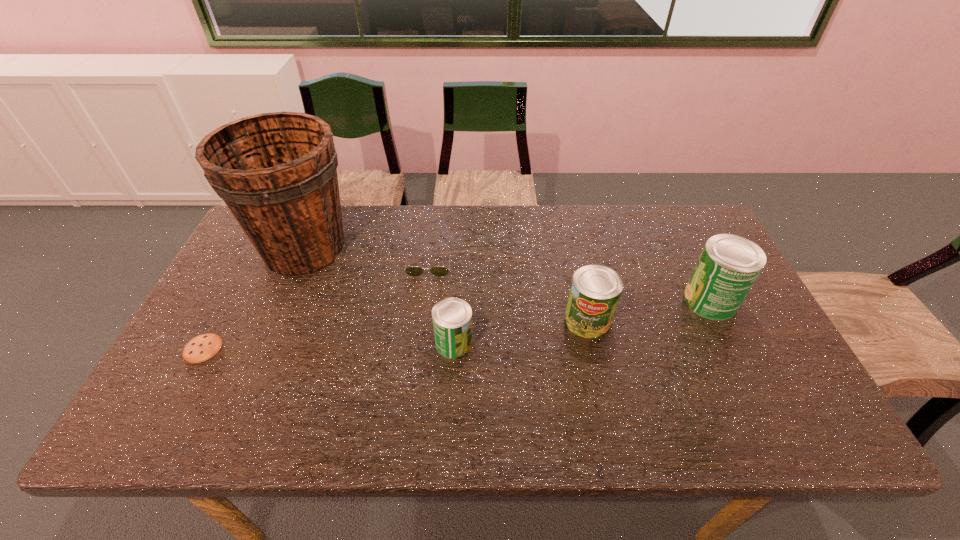
Where is `vacant space that satisfies the following two spatial constraints: 1. on the back side of the rightmost object; 2. on the left side of the third shortest object`? The image size is (960, 540). vacant space that satisfies the following two spatial constraints: 1. on the back side of the rightmost object; 2. on the left side of the third shortest object is located at coordinates (456, 300).

What are the coordinates of `vacant area that satisfies the following two spatial constraints: 1. on the front-facing side of the shortest can; 2. on the right side of the sunglasses` in the screenshot? It's located at (420, 343).

Image resolution: width=960 pixels, height=540 pixels. Identify the location of vacant area in the image that satisfies the following two spatial constraints: 1. on the front-facing side of the sunglasses; 2. on the right side of the fifth object from left to right. (422, 321).

Locate an element on the screen. The height and width of the screenshot is (540, 960). free space that satisfies the following two spatial constraints: 1. on the back side of the cookie; 2. on the right side of the fifth object from left to right is located at coordinates (217, 321).